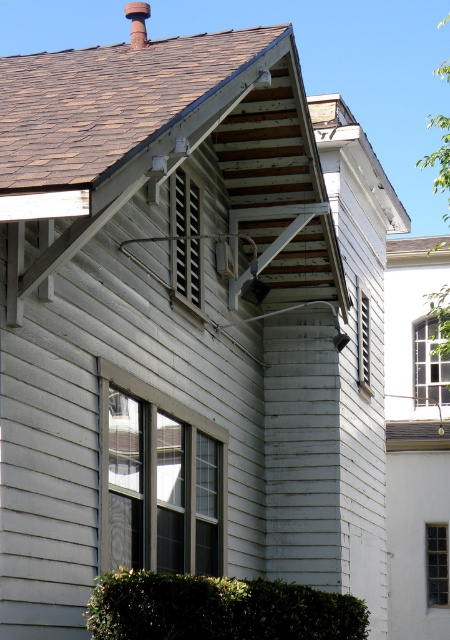
You are standing in the garden looking at the house. You notice the green leafy hedge at lower center and the smooth brick chimney at upper center. Which object is closer to you?

The green leafy hedge at lower center is closer to you because it is in front of the smooth brick chimney at upper center.

You are standing at the base of the two story wooden house and want to plant a new flower bed between the green leafy hedge at lower center and the small chimney at top left corner. Is there enough space to place a 100 foot long flower bed between them?

The distance between the green leafy hedge at lower center and the small chimney at top left corner is 70.99 feet. Since the flower bed is 100 feet long, it will not fit between them as the available space is shorter than the required length.